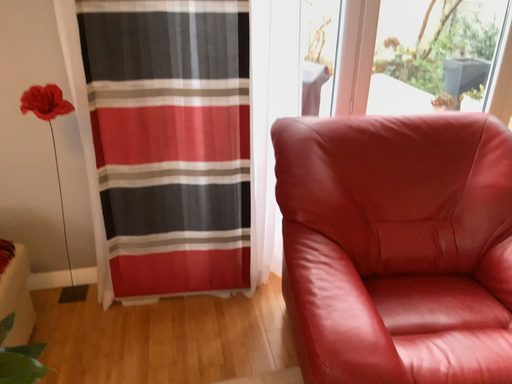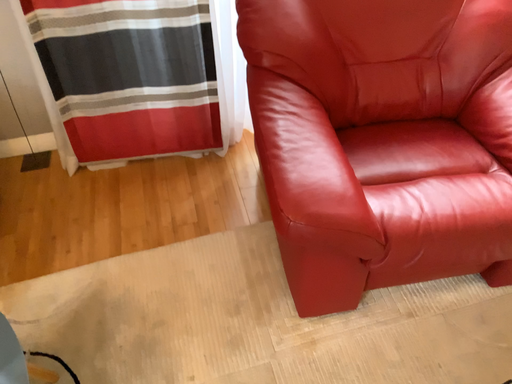
Question: How did the camera likely rotate when shooting the video?

Choices:
 (A) rotated downward
 (B) rotated upward

Answer: (A)